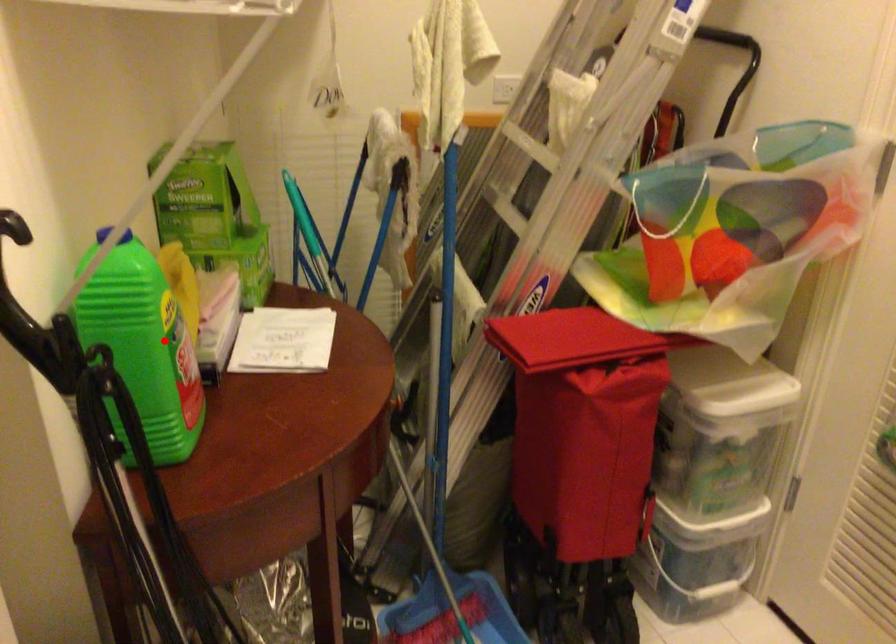
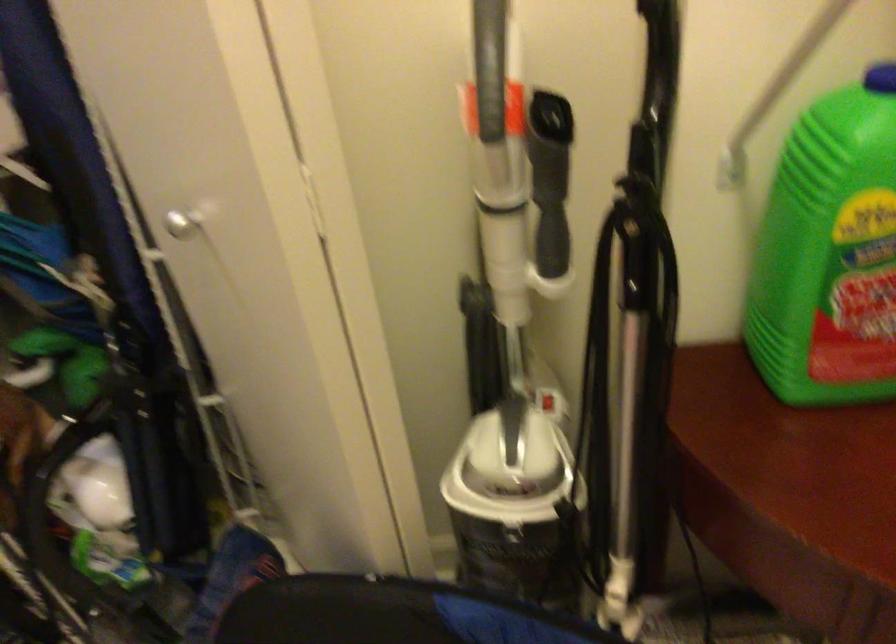
Question: I am providing you with two images of the same scene from different viewpoints. A red point is shown in image1. For the corresponding object point in image2, is it positioned nearer or farther from the camera?

Choices:
 (A) Nearer
 (B) Farther

Answer: (A)